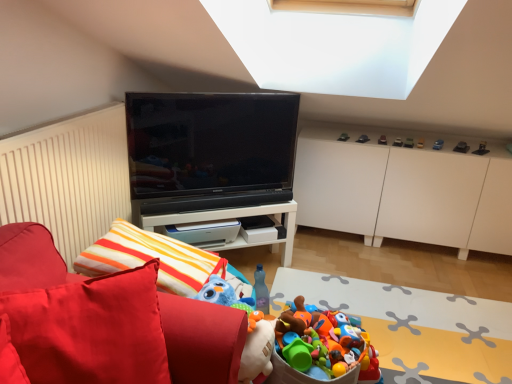
At what (x,y) coordinates should I click in order to perform the action: click on vacant area that lies between metallic blue car at upper right, the 3th toy when ordered from right to left, and metallic gray toy car at upper right, the 10th toy positioned from the left. Please return your answer as a coordinate pair (x, y). Looking at the image, I should click on click(446, 145).